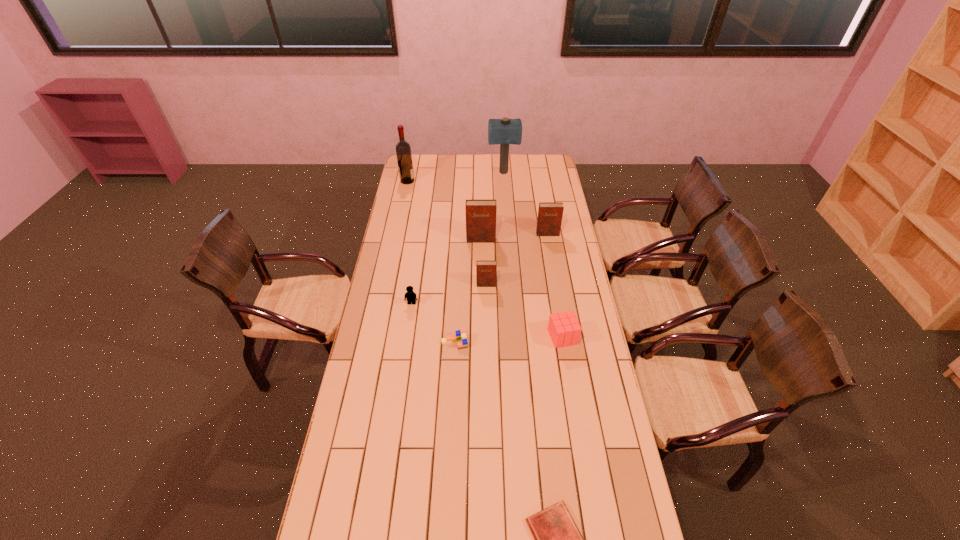
The width and height of the screenshot is (960, 540). In order to click on mallet in this screenshot , I will do `click(505, 131)`.

At what (x,y) coordinates should I click in order to perform the action: click on green alcohol. Please return your answer as a coordinate pair (x, y). Looking at the image, I should click on (403, 150).

Locate an element on the screen. alcohol is located at coordinates (403, 150).

This screenshot has height=540, width=960. Find the location of `the third tallest object`. the third tallest object is located at coordinates (480, 214).

Locate an element on the screen. Image resolution: width=960 pixels, height=540 pixels. the biggest reddish-brown diary is located at coordinates (480, 214).

Where is `the fourth tallest object`? The height and width of the screenshot is (540, 960). the fourth tallest object is located at coordinates (550, 214).

Locate an element on the screen. the second biggest reddish-brown diary is located at coordinates (550, 214).

Where is `the fifth nearest object`? the fifth nearest object is located at coordinates (485, 270).

I want to click on the smallest reddish-brown diary, so click(x=485, y=270).

The height and width of the screenshot is (540, 960). What are the coordinates of `cube` in the screenshot? It's located at (564, 329).